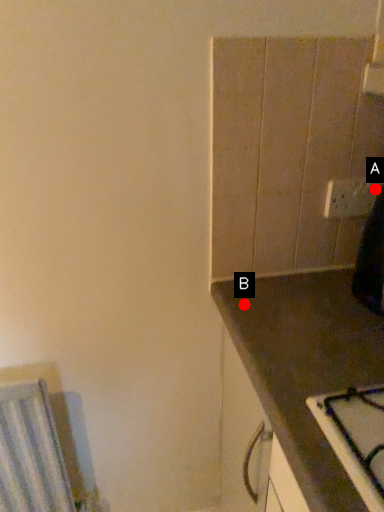
Question: Two points are circled on the image, labeled by A and B beside each circle. Which point is further to the camera?

Choices:
 (A) A is further
 (B) B is further

Answer: (A)